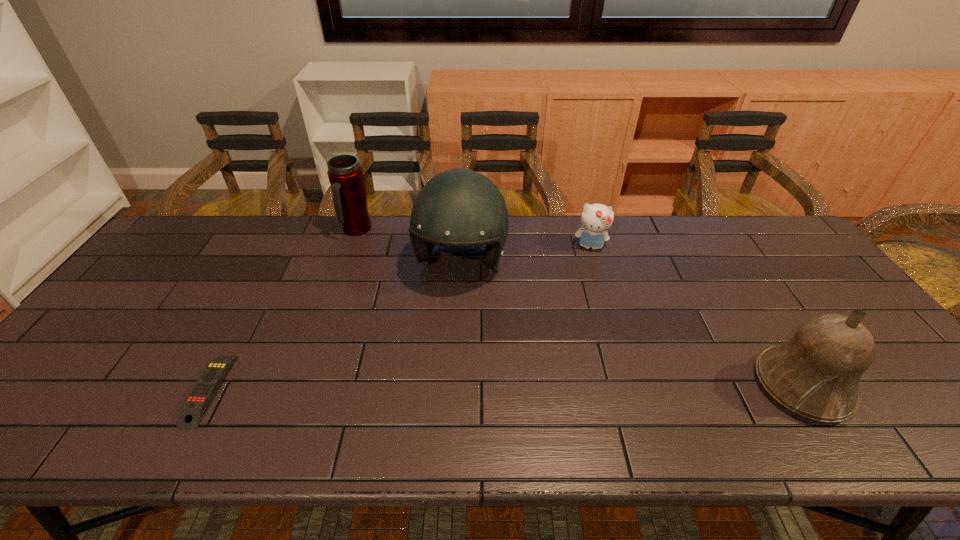
Identify the location of free spot between the football helmet and the leftmost object. (335, 327).

Where is `free space between the thermos bottle and the third object from left to right`? Image resolution: width=960 pixels, height=540 pixels. free space between the thermos bottle and the third object from left to right is located at coordinates (409, 247).

Find the location of a particular element. vacant space that is in between the bell and the remote control is located at coordinates (505, 388).

Image resolution: width=960 pixels, height=540 pixels. Identify the location of free spot between the bell and the fourth tallest object. (696, 316).

Where is `vacant area that lies between the second object from right to left and the rightmost object`? vacant area that lies between the second object from right to left and the rightmost object is located at coordinates (696, 316).

Find the location of a particular element. The image size is (960, 540). vacant area that lies between the fourth tallest object and the football helmet is located at coordinates (525, 255).

This screenshot has height=540, width=960. I want to click on vacant area that lies between the bell and the third object from right to left, so click(x=632, y=325).

Locate an element on the screen. This screenshot has height=540, width=960. object that is the closest to the second object from left to right is located at coordinates (458, 207).

Locate which object is the fourth closest to the shortest object. Please provide its 2D coordinates. Your answer should be formatted as a tuple, i.e. [(x, y)], where the tuple contains the x and y coordinates of a point satisfying the conditions above.

[(815, 374)]

At what (x,y) coordinates should I click in order to perform the action: click on free space that satisfies the following two spatial constraints: 1. on the front side of the rightmost object; 2. on the left side of the kitten. Please return your answer as a coordinate pair (x, y). Image resolution: width=960 pixels, height=540 pixels. Looking at the image, I should click on (632, 386).